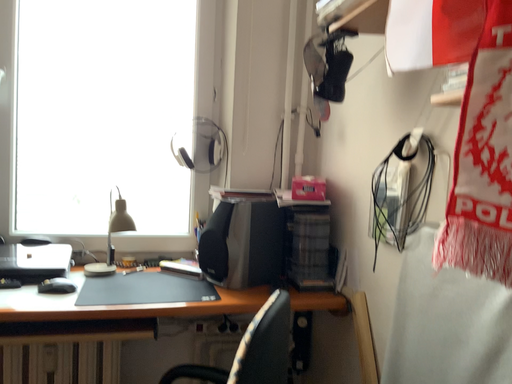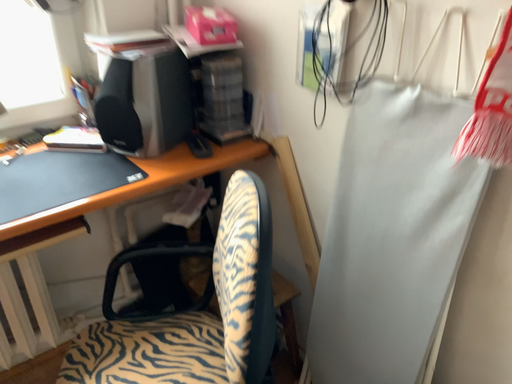
Question: How did the camera likely rotate when shooting the video?

Choices:
 (A) rotated upward
 (B) rotated downward

Answer: (B)